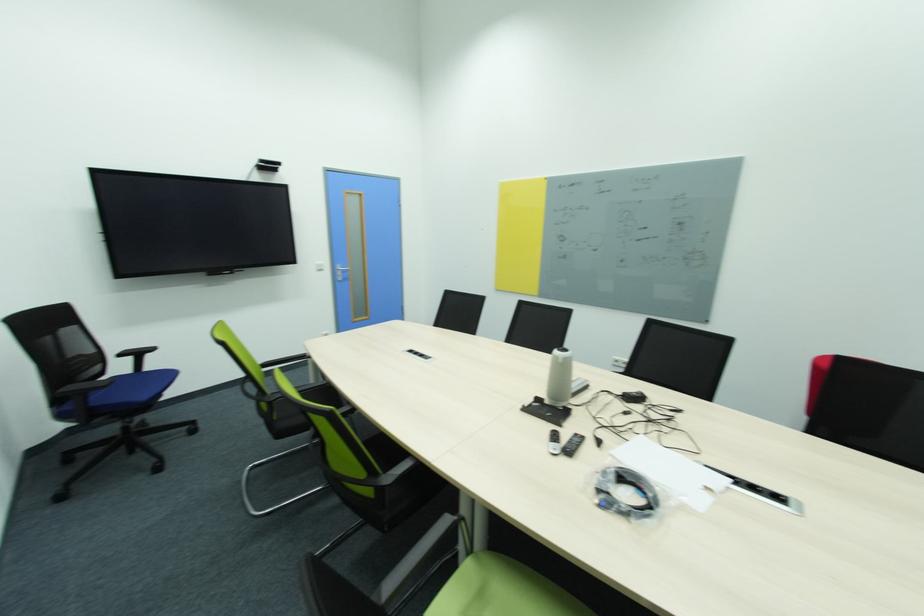
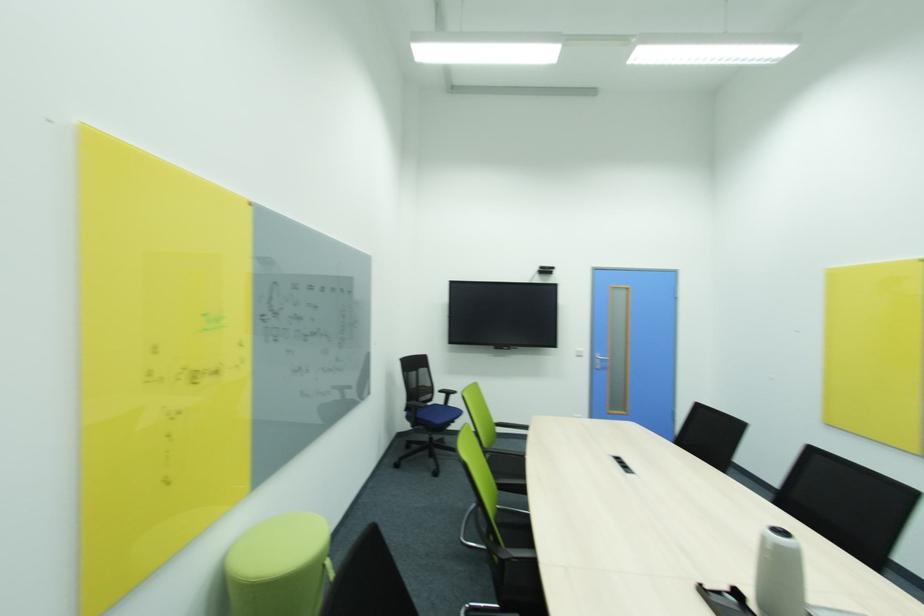
Question: The camera is either moving clockwise (left) or counter-clockwise (right) around the object. The first image is from the beginning of the video and the second image is from the end. Is the camera moving left or right when shooting the video?

Choices:
 (A) Left
 (B) Right

Answer: (B)